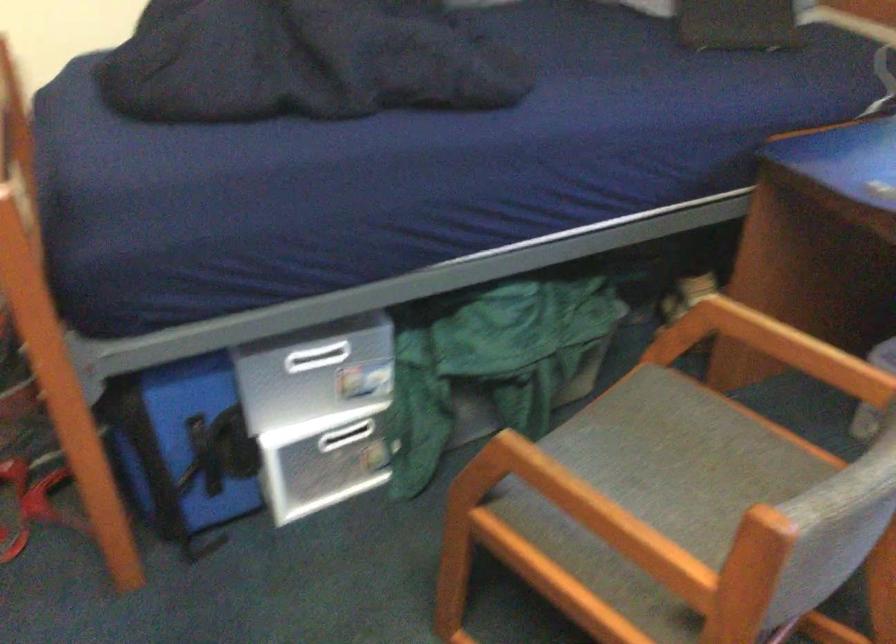
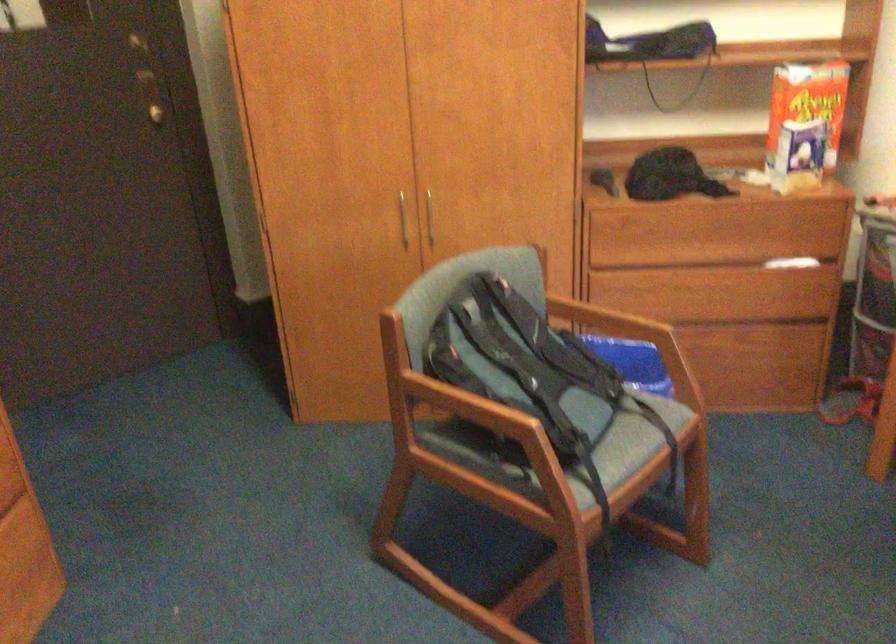
Question: How did the camera likely rotate?

Choices:
 (A) Left
 (B) Right
 (C) Up
 (D) Down

Answer: (A)